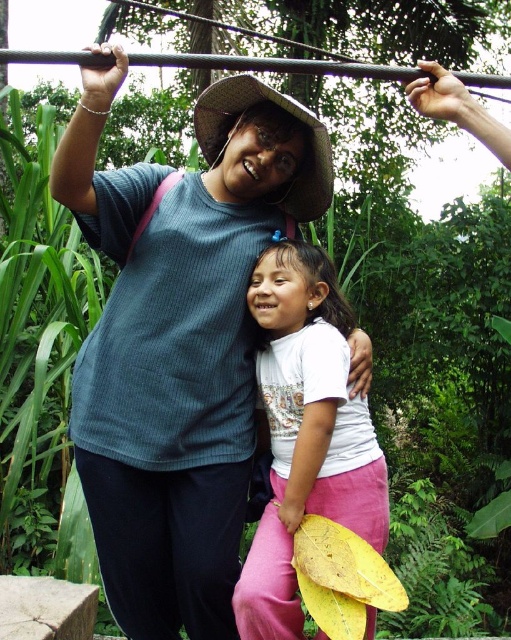
Can you confirm if blue ribbed shirt at center is positioned to the left of white matte shirt at center?

Correct, you'll find blue ribbed shirt at center to the left of white matte shirt at center.

Can you confirm if blue ribbed shirt at center is positioned above white matte shirt at center?

Yes, blue ribbed shirt at center is above white matte shirt at center.

In the scene shown: Measure the distance between blue ribbed shirt at center and camera.

blue ribbed shirt at center is 2.12 meters away from camera.

Find the location of a particular element. blue ribbed shirt at center is located at coordinates [178, 340].